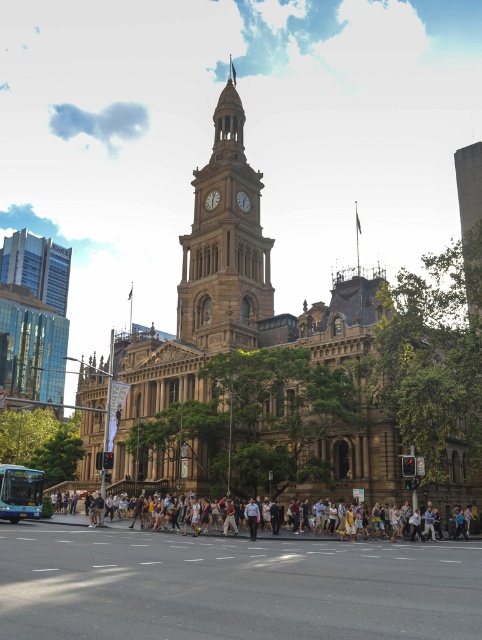
You are a delivery person needing to place a 30 feet long ladder between the brown stone clock tower at center and the white glossy clock at center. Can the ladder fit between them without overlapping either structure?

The distance between the brown stone clock tower at center and the white glossy clock at center is 28.75 feet. Since the ladder is 30 feet long, it is longer than the available space, so the ladder cannot fit between them without overlapping either structure.

You are standing on the pedestrian crossing in front of the historic building. You notice the brown stone clock tower at center and the gold metallic clock at center. Which one is positioned more to the left side from your viewpoint?

The brown stone clock tower at center is positioned to the left of the gold metallic clock at center, so it is more to the left side from your viewpoint.

You are standing at the point marked as point (x=209, y=193) and want to walk towards the clock tower. Is the point marked as point (x=316, y=492) located between you and the clock tower?

Yes, the point marked as point (x=316, y=492) is between you and the clock tower because it is closer to the camera than point (x=209, y=193), which means you are further away from the clock tower than that point.